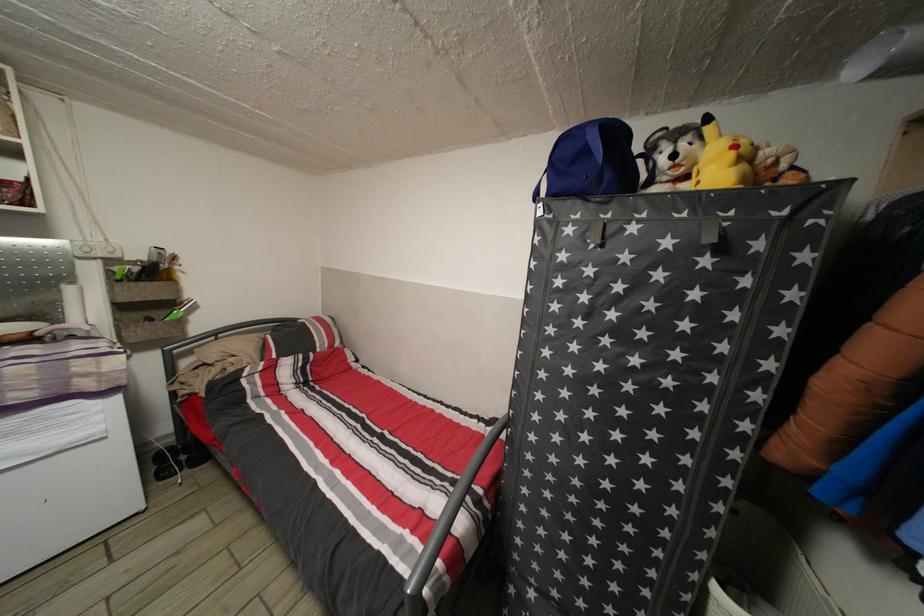
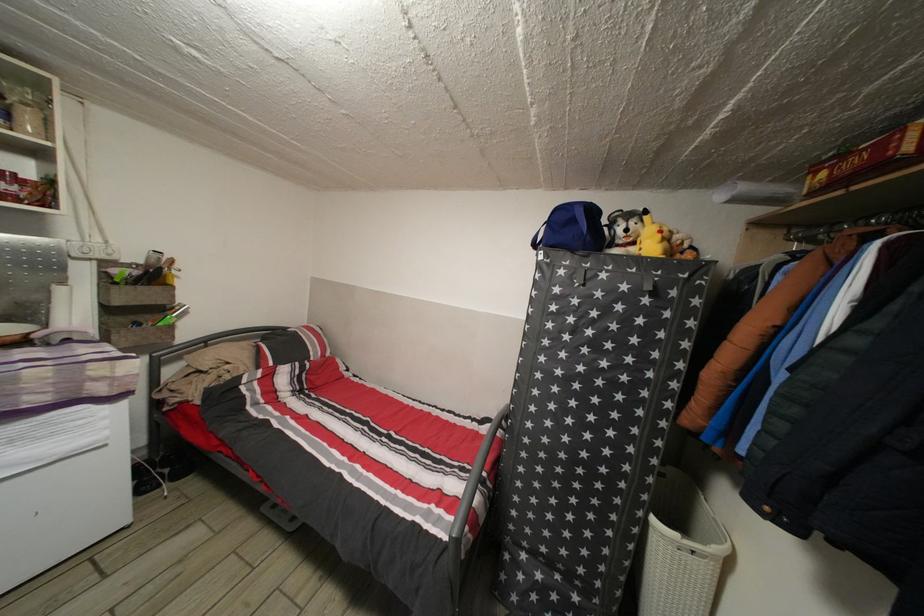
Question: The images are taken continuously from a first-person perspective. In which direction is your viewpoint rotating?

Choices:
 (A) Left
 (B) Right
 (C) Up
 (D) Down

Answer: (B)